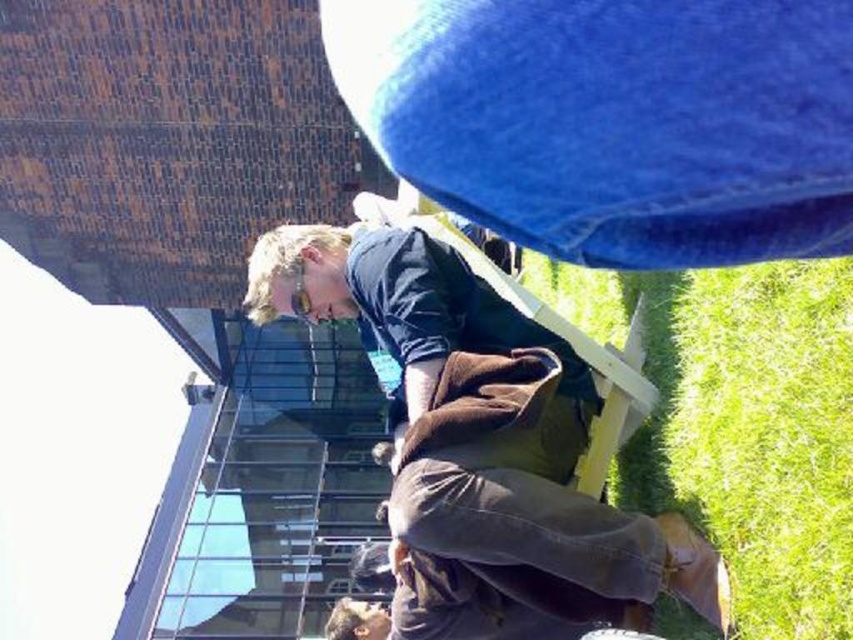
Which is below, brown cotton squat at center or green grass at lower right?

green grass at lower right is below.

Between brown cotton squat at center and green grass at lower right, which one has more height?

Standing taller between the two is brown cotton squat at center.

Is point (390, 528) closer to camera compared to point (838, 419)?

No, (390, 528) is further to viewer.

The height and width of the screenshot is (640, 853). What are the coordinates of `brown cotton squat at center` in the screenshot? It's located at (483, 449).